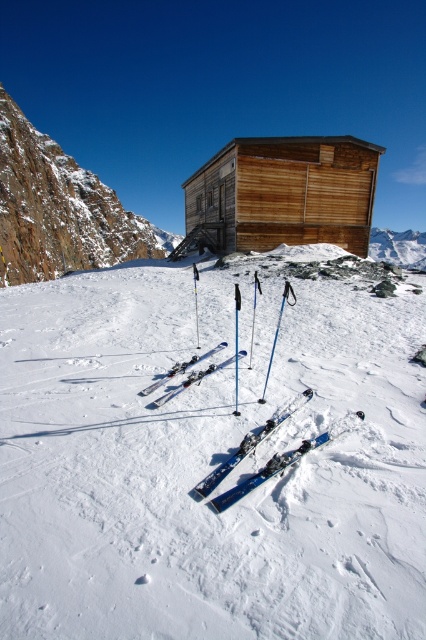
You are a skier who wants to reach the wooden cabin at center from the shiny metallic skis at center. Considering the distance between them, can you estimate how long it would take you to walk there if your walking speed is 3 miles per hour?

The distance between the shiny metallic skis at center and the wooden cabin at center is 40.22 feet. Converting this distance to miles, it is approximately 0.0076 miles. At a walking speed of 3 mph, the time required would be roughly 0.0076 miles divided by 3 mph, which equals about 0.0025 hours. Converting hours to seconds, this is roughly 9 seconds. Therefore, it would take approximately 9 seconds to walk from the shiny metallic skis at center to the wooden cabin at center.

You are planning to carry both the shiny metallic skis at center and the wooden cabin at center to a storage room. Which object requires more horizontal space due to its greater width?

The shiny metallic skis at center requires more horizontal space because its width surpasses that of the wooden cabin at center.